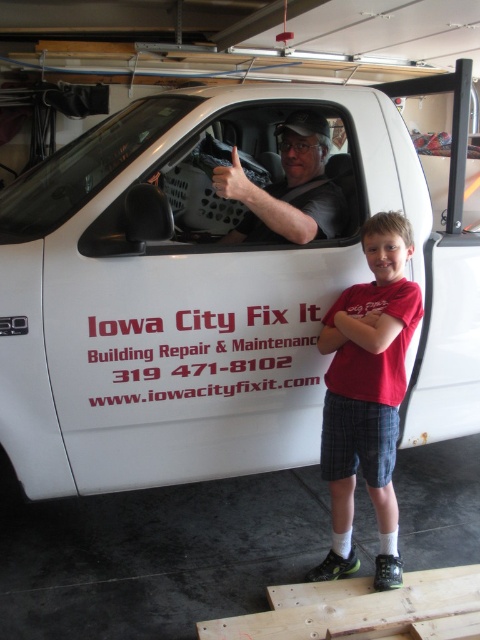
Between red cotton shirt at center and matte black shirt at center, which one is positioned lower?

Positioned lower is red cotton shirt at center.

I want to click on red cotton shirt at center, so click(x=368, y=394).

In order to click on red cotton shirt at center in this screenshot , I will do `click(368, 394)`.

Between point (140, 141) and point (328, 131), which one is positioned behind?

Point (328, 131)

Which is more to the left, transparent glass windshield at upper left or matte black shirt at center?

From the viewer's perspective, transparent glass windshield at upper left appears more on the left side.

Who is more forward, [153,138] or [264,204]?

Point [264,204]

Find the location of `transparent glass windshield at upper left`. transparent glass windshield at upper left is located at coordinates (84, 166).

Is white matte van at center wider than matte black shirt at center?

Yes.

In the scene shown: Is white matte van at center shorter than matte black shirt at center?

No.

Identify the location of white matte van at center. The image size is (480, 640). (215, 289).

What are the coordinates of `white matte van at center` in the screenshot? It's located at (215, 289).